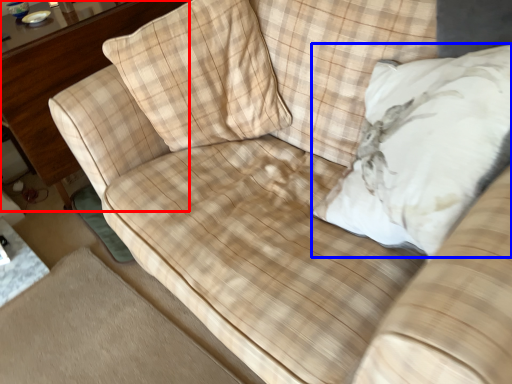
Question: Which point is closer to the camera, dresser (highlighted by a red box) or throw pillow (highlighted by a blue box)?

Choices:
 (A) dresser
 (B) throw pillow

Answer: (B)